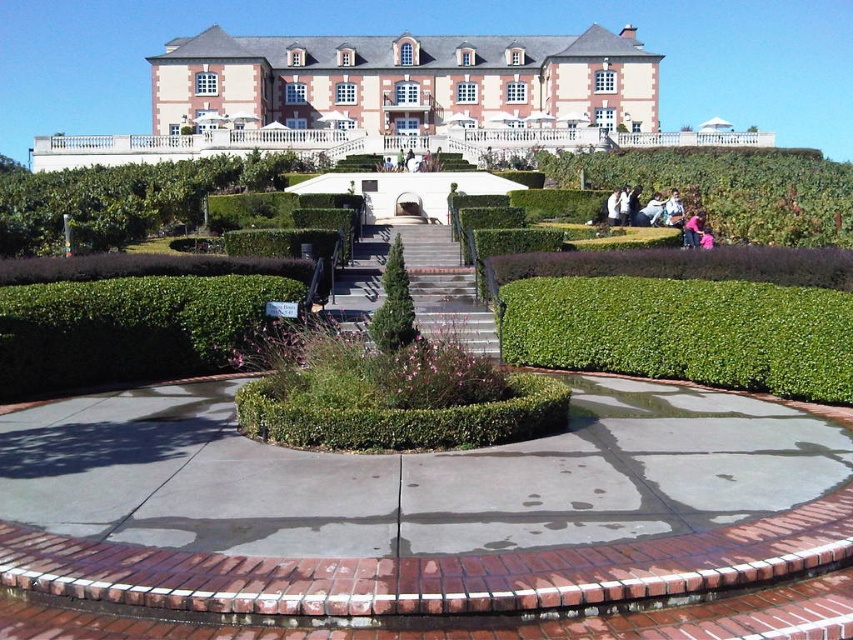
Does matte pink and white palace at upper center have a larger size compared to green textured bush at center?

Yes.

Does matte pink and white palace at upper center have a smaller size compared to green textured bush at center?

Incorrect, matte pink and white palace at upper center is not smaller in size than green textured bush at center.

Is point (410, 51) positioned before point (390, 289)?

That is False.

Locate an element on the screen. matte pink and white palace at upper center is located at coordinates (404, 83).

Which is in front, point (645, 168) or point (683, 244)?

Positioned in front is point (683, 244).

Is green leafy hedge at center right positioned behind pink fabric at lower right?

No, it is not.

Identify the location of green leafy hedge at center right. This screenshot has height=640, width=853. (730, 188).

Find the location of a particular element. The width and height of the screenshot is (853, 640). green leafy hedge at center is located at coordinates (683, 332).

Locate an element on the screen. green leafy hedge at center is located at coordinates (683, 332).